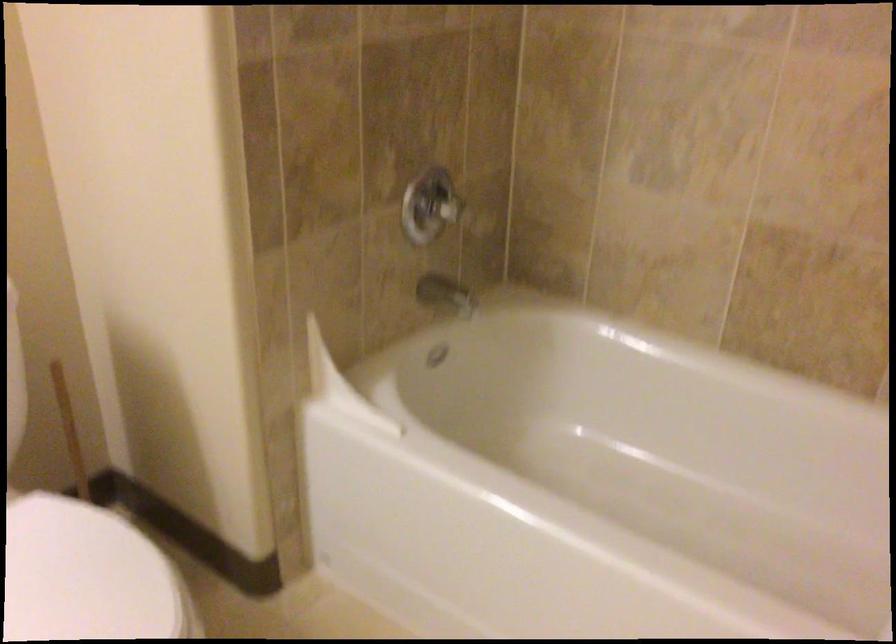
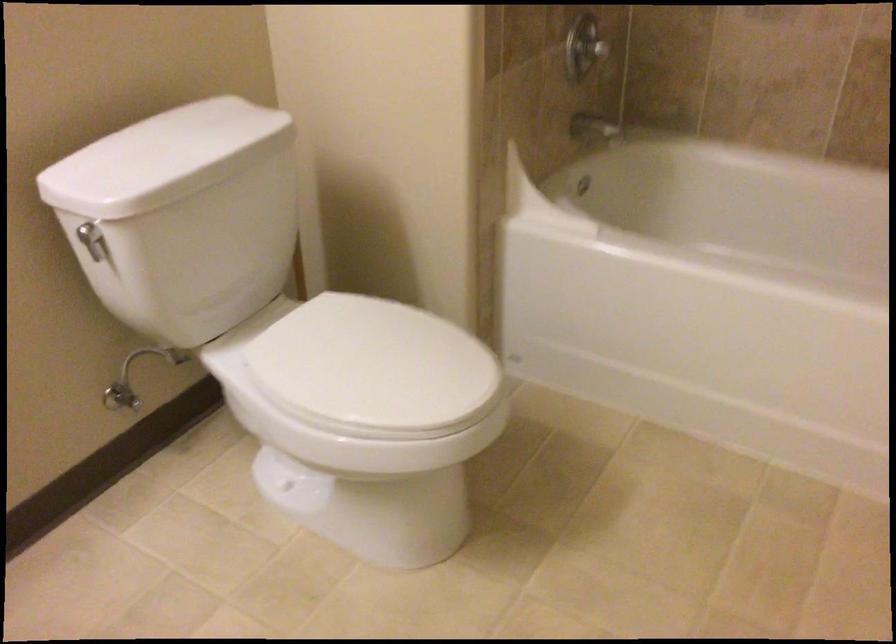
The images are taken continuously from a first-person perspective. In which direction are you moving?

The cameraman moved toward left, backward.